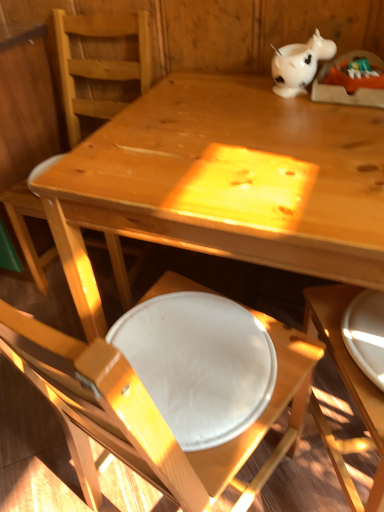
Question: Does white glossy piggy bank at upper right have a larger size compared to white glossy plate at lower right?

Choices:
 (A) yes
 (B) no

Answer: (A)

Question: From a real-world perspective, is white glossy piggy bank at upper right positioned under white glossy plate at lower right based on gravity?

Choices:
 (A) no
 (B) yes

Answer: (A)

Question: Does white glossy piggy bank at upper right have a smaller size compared to white glossy plate at lower right?

Choices:
 (A) no
 (B) yes

Answer: (A)

Question: Is white glossy piggy bank at upper right positioned behind white glossy plate at lower right?

Choices:
 (A) no
 (B) yes

Answer: (B)

Question: Is white glossy piggy bank at upper right in contact with white glossy plate at lower right?

Choices:
 (A) no
 (B) yes

Answer: (A)

Question: In terms of height, does white glossy plate at lower right look taller or shorter compared to matte wood chair at center, which ranks as the first chair in back-to-front order?

Choices:
 (A) tall
 (B) short

Answer: (B)

Question: Considering the positions of point (370, 316) and point (26, 252), is point (370, 316) closer or farther from the camera than point (26, 252)?

Choices:
 (A) closer
 (B) farther

Answer: (A)

Question: Would you say white glossy plate at lower right is to the left or to the right of matte wood chair at center, which is counted as the 2th chair, starting from the front, in the picture?

Choices:
 (A) left
 (B) right

Answer: (B)

Question: Is white glossy plate at lower right in front of or behind matte wood chair at center, which ranks as the first chair in back-to-front order, in the image?

Choices:
 (A) front
 (B) behind

Answer: (A)

Question: Considering the positions of white glossy piggy bank at upper right and matte wood chair at center, which is counted as the 2th chair, starting from the front, in the image, is white glossy piggy bank at upper right wider or thinner than matte wood chair at center, which is counted as the 2th chair, starting from the front,?

Choices:
 (A) thin
 (B) wide

Answer: (A)

Question: In terms of size, does white glossy piggy bank at upper right appear bigger or smaller than matte wood chair at center, which is counted as the 2th chair, starting from the front?

Choices:
 (A) small
 (B) big

Answer: (A)

Question: Does point (283, 86) appear closer or farther from the camera than point (92, 22)?

Choices:
 (A) closer
 (B) farther

Answer: (A)

Question: From the image's perspective, is white glossy piggy bank at upper right positioned above or below matte wood chair at center, which ranks as the first chair in back-to-front order?

Choices:
 (A) below
 (B) above

Answer: (B)

Question: Based on their positions, is white glossy piggy bank at upper right located to the left or right of white glossy plate at lower right?

Choices:
 (A) left
 (B) right

Answer: (A)

Question: Is white glossy piggy bank at upper right taller or shorter than white glossy plate at lower right?

Choices:
 (A) tall
 (B) short

Answer: (A)